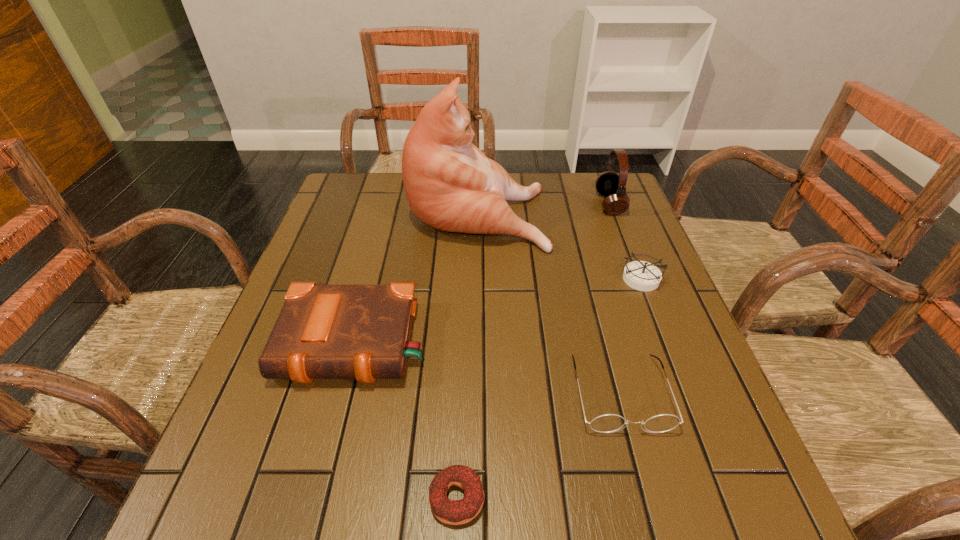
The width and height of the screenshot is (960, 540). What are the coordinates of `the tallest object` in the screenshot? It's located at (450, 184).

Where is `the fifth shortest object`? the fifth shortest object is located at coordinates (610, 184).

Locate an element on the screen. Bible is located at coordinates (362, 332).

Locate an element on the screen. the third farthest object is located at coordinates (640, 275).

This screenshot has width=960, height=540. In order to click on spectacles in this screenshot , I will do `click(609, 423)`.

The height and width of the screenshot is (540, 960). What are the coordinates of `the nearest object` in the screenshot? It's located at (453, 512).

Locate an element on the screen. This screenshot has height=540, width=960. the shortest object is located at coordinates (453, 512).

At what (x,y) coordinates should I click in order to perform the action: click on free point located 0.070m on the face of the cat. Please return your answer as a coordinate pair (x, y). This screenshot has height=540, width=960. Looking at the image, I should click on (569, 212).

Identify the location of vacant area located 0.180m on the ear pads of the headset. This screenshot has height=540, width=960. (536, 204).

You are a GUI agent. You are given a task and a screenshot of the screen. Output one action in this format:
    pyautogui.click(x=<x>, y=<y>)
    Task: Click on the vacant space situated on the ear pads of the headset
    The height and width of the screenshot is (540, 960).
    Given the screenshot: What is the action you would take?
    pyautogui.click(x=573, y=204)